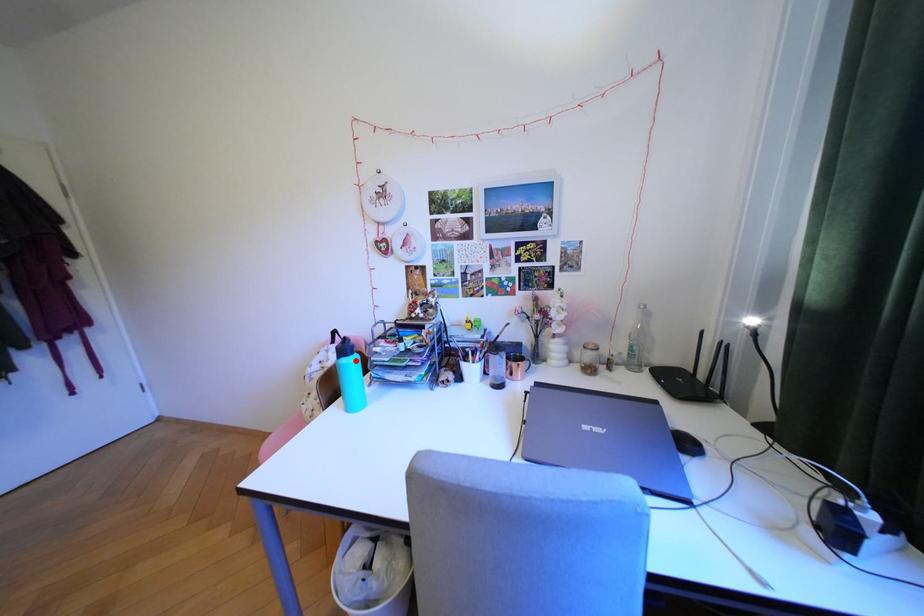
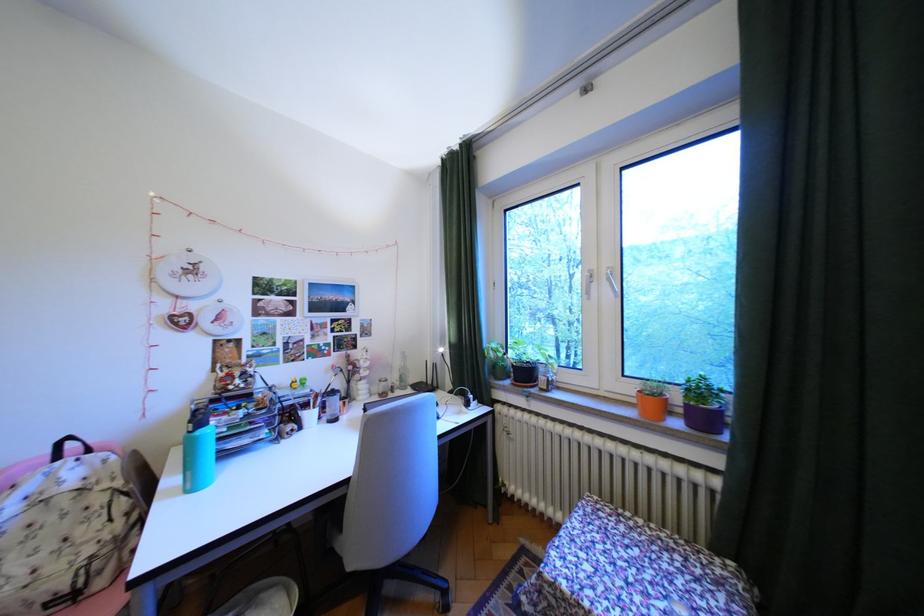
In the second image, find the point that corresponds to the highlighted location in the first image.

(212, 432)